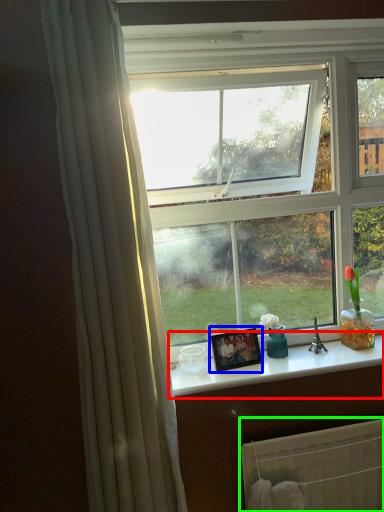
Question: Based on their relative distances, which object is nearer to counter top (highlighted by a red box)? Choose from picture frame (highlighted by a blue box) and radiator (highlighted by a green box).

Choices:
 (A) picture frame
 (B) radiator

Answer: (A)